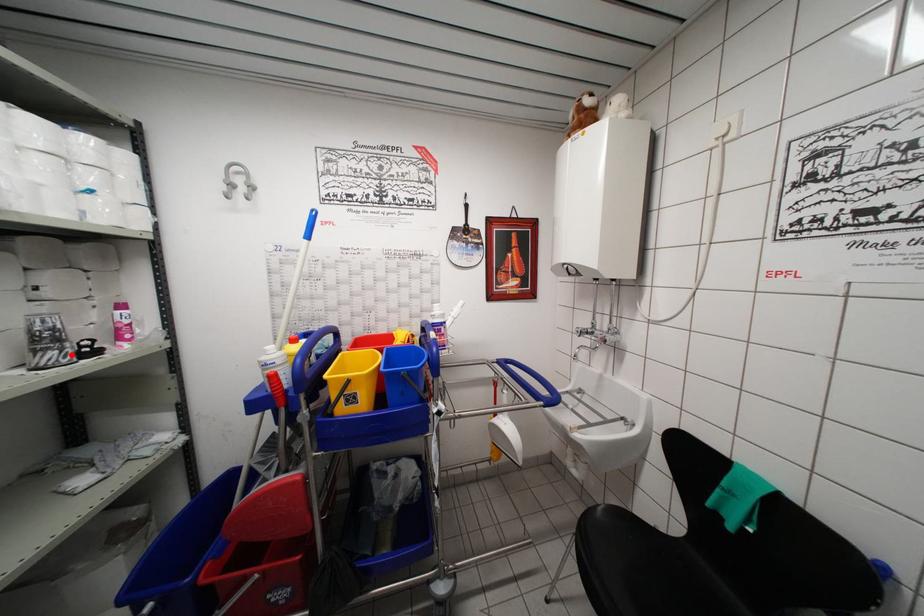
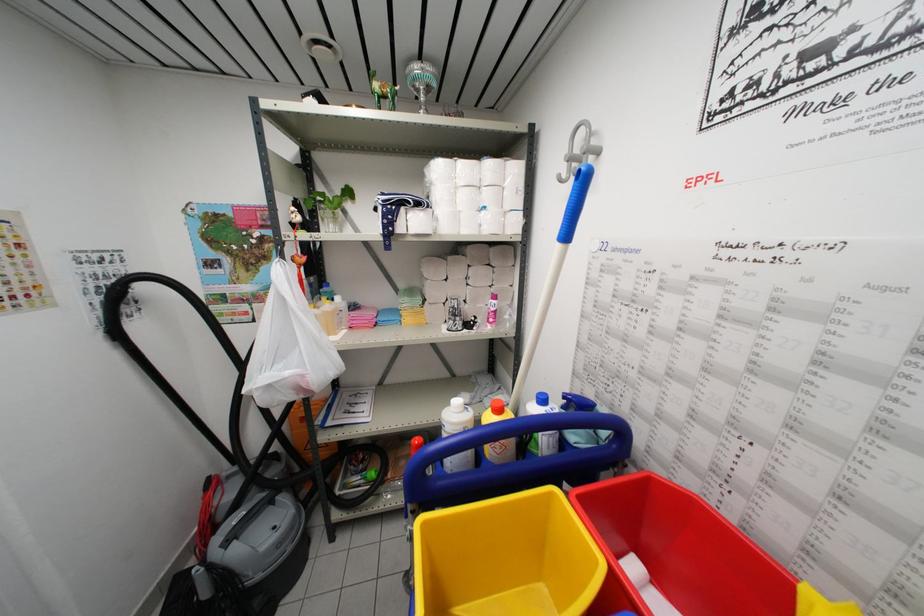
Find the pixel in the second image that matches the highlighted location in the first image.

(459, 326)